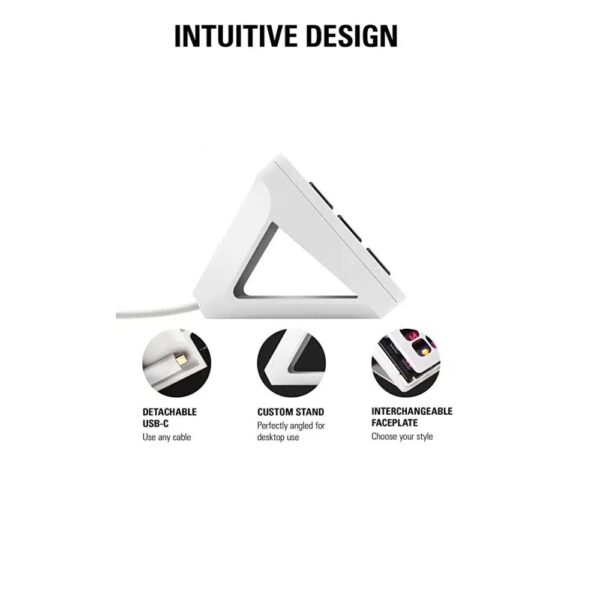
Show me where where the power cord meets the stand are located in the image. Your answer should be formatted as a list of tuples, i.e. [(x1, y1), (x2, y2), ...], where each tuple contains the x and y coordinates of a point satisfying the conditions above.

[(197, 305)]